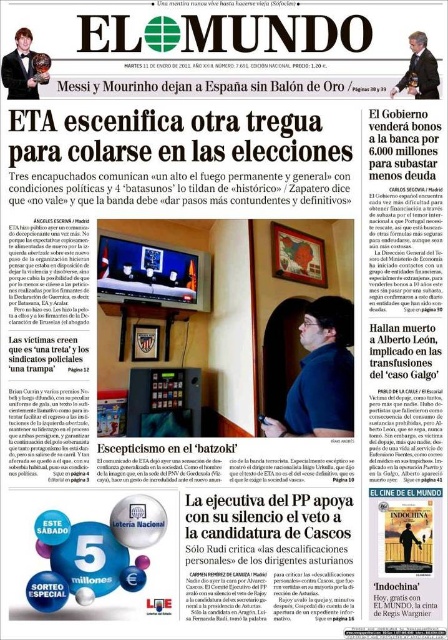
Which is below, black plastic phone at center or shiny black tuxedo at upper left?

black plastic phone at center is lower down.

Which is more to the left, black plastic phone at center or shiny black tuxedo at upper left?

shiny black tuxedo at upper left is more to the left.

Is point (323, 419) closer to camera compared to point (20, 51)?

That is True.

Identify the location of black plastic phone at center. pyautogui.click(x=321, y=376).

Can you confirm if shiny black tuxedo at upper left is positioned above suit at upper right?

Yes.

Can you confirm if shiny black tuxedo at upper left is bigger than suit at upper right?

Incorrect, shiny black tuxedo at upper left is not larger than suit at upper right.

Identify the location of shiny black tuxedo at upper left. The height and width of the screenshot is (640, 448). (21, 68).

Between black plastic phone at center and suit at upper right, which one has more height?

black plastic phone at center

Is black plastic phone at center smaller than suit at upper right?

Actually, black plastic phone at center might be larger than suit at upper right.

Between point (336, 353) and point (427, 68), which one is positioned in front?

Positioned in front is point (427, 68).

What are the coordinates of `black plastic phone at center` in the screenshot? It's located at (321, 376).